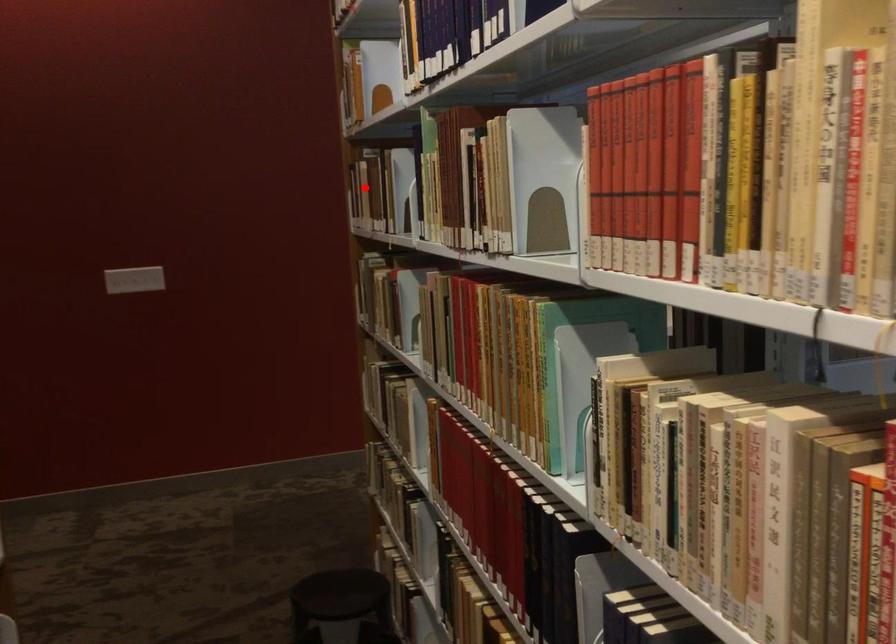
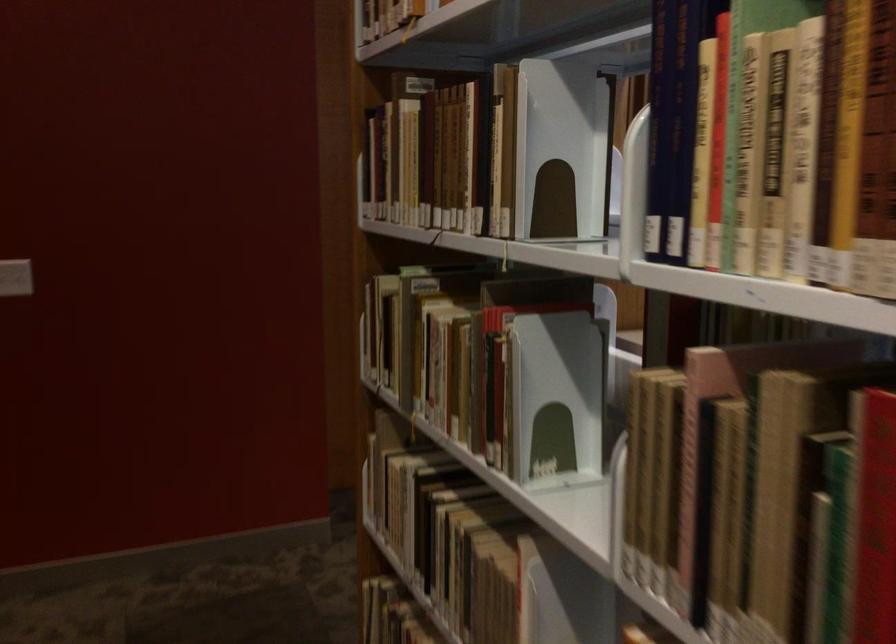
Question: I am providing you with two images of the same scene from different viewpoints. Image1 has a red point marked. In image2, the corresponding 3D location appears at what relative position? Reply with the corresponding letter.

Choices:
 (A) Closer
 (B) Farther

Answer: (A)